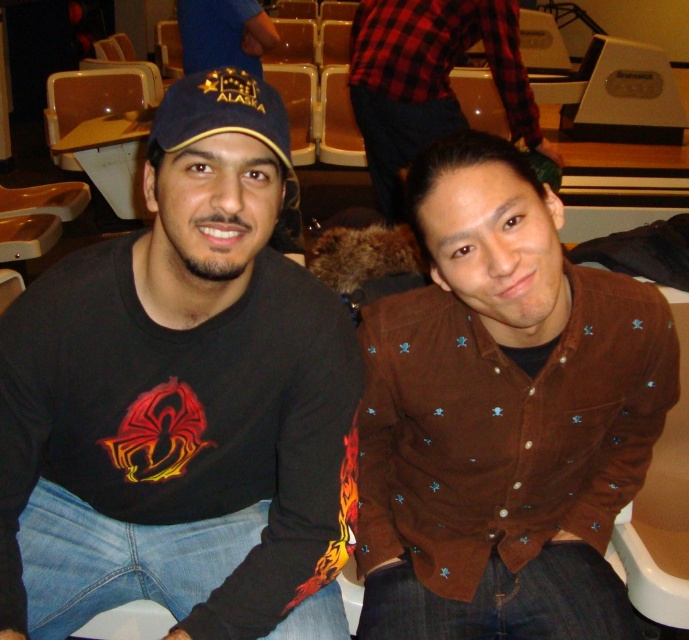
Who is taller, black matte t-shirt at center or blue fabric cap at upper center?

black matte t-shirt at center is taller.

Can you confirm if black matte t-shirt at center is positioned to the left of blue fabric cap at upper center?

No, black matte t-shirt at center is not to the left of blue fabric cap at upper center.

Between point (154, 388) and point (249, 19), which one is positioned in front?

Positioned in front is point (154, 388).

Find the location of a particular element. black matte t-shirt at center is located at coordinates (189, 369).

Who is lower down, black matte t-shirt at center or brown corduroy shirt at center?

Positioned lower is black matte t-shirt at center.

Is black matte t-shirt at center shorter than brown corduroy shirt at center?

In fact, black matte t-shirt at center may be taller than brown corduroy shirt at center.

Is point (229, 90) in front of point (418, 388)?

Yes, point (229, 90) is in front of point (418, 388).

This screenshot has height=640, width=689. Find the location of `black matte t-shirt at center`. black matte t-shirt at center is located at coordinates (189, 369).

Identify the location of brown corduroy shirt at center. (502, 416).

Who is positioned more to the right, brown corduroy shirt at center or blue fabric cap at upper center?

brown corduroy shirt at center is more to the right.

Between point (508, 636) and point (245, 26), which one is positioned in front?

Positioned in front is point (508, 636).

Where is `brown corduroy shirt at center`? brown corduroy shirt at center is located at coordinates (502, 416).